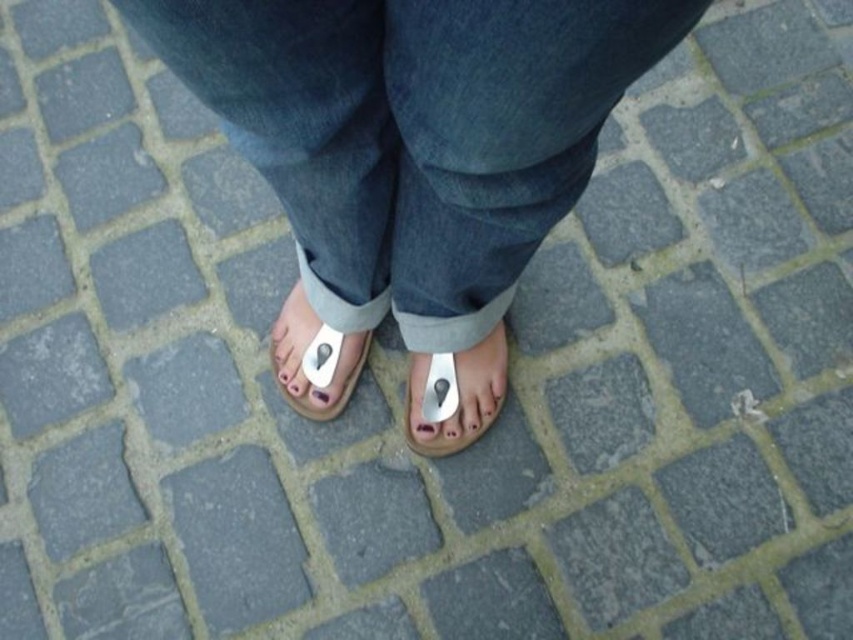
Between metallic silver flip-flop at center and matte plastic toe at center, which one has more height?

With more height is metallic silver flip-flop at center.

Between metallic silver flip-flop at center and matte plastic toe at center, which one appears on the left side from the viewer's perspective?

metallic silver flip-flop at center is more to the left.

Is point (314, 413) less distant than point (425, 429)?

No.

At what (x,y) coordinates should I click in order to perform the action: click on metallic silver flip-flop at center. Please return your answer as a coordinate pair (x, y). Looking at the image, I should click on (314, 358).

Where is `silver metallic flip-flop at center`? Image resolution: width=853 pixels, height=640 pixels. silver metallic flip-flop at center is located at coordinates (454, 396).

Is silver metallic flip-flop at center positioned at the back of metallic silver flip-flop at center?

A: No, silver metallic flip-flop at center is closer to the viewer.

Is point (456, 358) closer to viewer compared to point (303, 305)?

Yes, point (456, 358) is closer to viewer.

Find the location of `silver metallic flip-flop at center`. silver metallic flip-flop at center is located at coordinates (454, 396).

Between denim at center and matte plastic toe at center, which one appears on the left side from the viewer's perspective?

denim at center is more to the left.

Does point (206, 60) come closer to viewer compared to point (428, 436)?

Yes, it is.

Describe the element at coordinates (415, 132) in the screenshot. Image resolution: width=853 pixels, height=640 pixels. I see `denim at center` at that location.

Find the location of `denim at center`. denim at center is located at coordinates (415, 132).